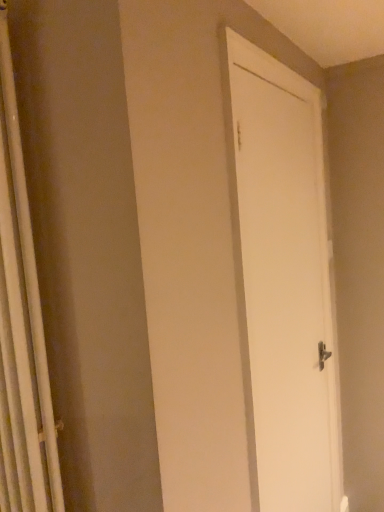
Question: From the image's perspective, is white matte door at center on top of white fabric shower curtain at left?

Choices:
 (A) no
 (B) yes

Answer: (A)

Question: Is white matte door at center thinner than white fabric shower curtain at left?

Choices:
 (A) yes
 (B) no

Answer: (A)

Question: Does white matte door at center have a greater height compared to white fabric shower curtain at left?

Choices:
 (A) no
 (B) yes

Answer: (B)

Question: Would you say white matte door at center is outside white fabric shower curtain at left?

Choices:
 (A) yes
 (B) no

Answer: (A)

Question: From the image's perspective, is white matte door at center under white fabric shower curtain at left?

Choices:
 (A) yes
 (B) no

Answer: (A)

Question: Is white matte door at center aimed at white fabric shower curtain at left?

Choices:
 (A) yes
 (B) no

Answer: (B)

Question: Is white fabric shower curtain at left at the right side of white matte door at center?

Choices:
 (A) no
 (B) yes

Answer: (A)

Question: From a real-world perspective, is white fabric shower curtain at left under white matte door at center?

Choices:
 (A) yes
 (B) no

Answer: (B)

Question: Is white fabric shower curtain at left smaller than white matte door at center?

Choices:
 (A) no
 (B) yes

Answer: (B)

Question: Does white fabric shower curtain at left have a greater height compared to white matte door at center?

Choices:
 (A) no
 (B) yes

Answer: (A)

Question: Is white matte door at center inside white fabric shower curtain at left?

Choices:
 (A) yes
 (B) no

Answer: (B)

Question: Is white fabric shower curtain at left touching white matte door at center?

Choices:
 (A) no
 (B) yes

Answer: (A)

Question: Is white matte door at center to the left or to the right of white fabric shower curtain at left in the image?

Choices:
 (A) right
 (B) left

Answer: (A)